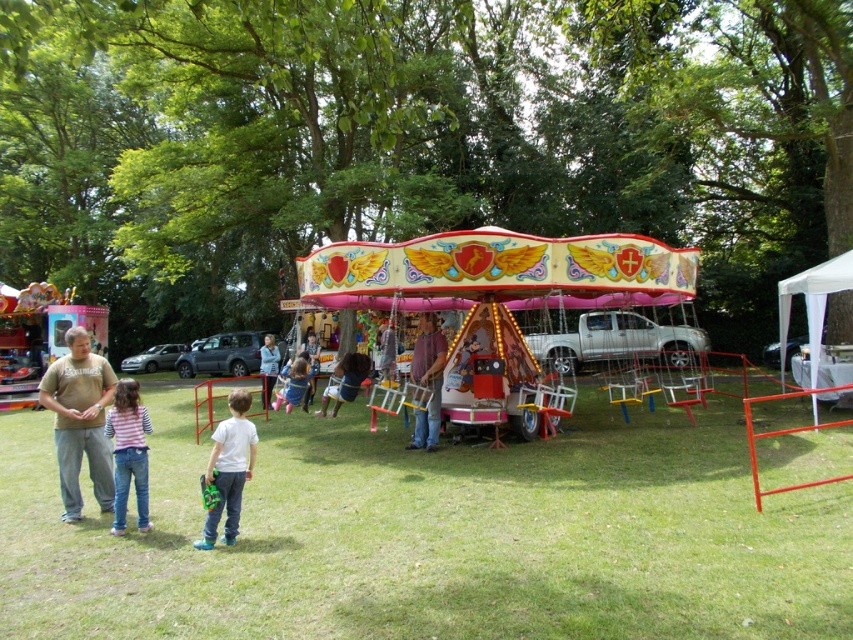
You are a photographer at the carnival. You want to capture a photo of the matte pink swing at center and the matte pink dress at center without any obstruction. Based on their positions, which one should you focus on first to ensure both are in frame?

The matte pink swing at center is located below the matte pink dress at center. To ensure both are in frame, focus on the matte pink dress at center first as it is higher up, allowing the swing to naturally fall into the lower part of the frame.

You are an event planner trying to arrange decorations around the carousel. You have a matte pink swing at center and a matte pink dress at center. Which object requires more space to accommodate?

The matte pink dress at center requires more space because the matte pink swing at center occupies less space than it.